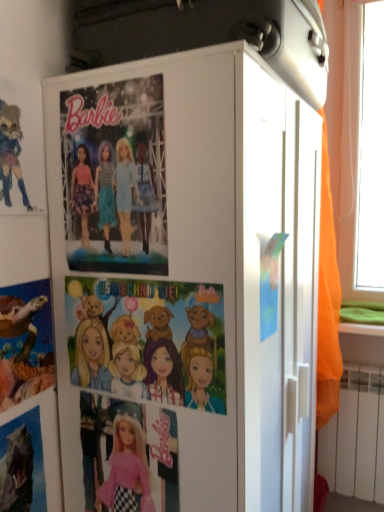
Question: Based on their sizes in the image, would you say shiny metallic dinosaur at lower left, which appears as the 2th comic book when viewed from the left, is bigger or smaller than matte plastic turtle at lower left, arranged as the first comic book when viewed from the left?

Choices:
 (A) big
 (B) small

Answer: (B)

Question: Is shiny metallic dinosaur at lower left, which is counted as the 2th comic book, starting from the right, situated inside matte plastic turtle at lower left, arranged as the first comic book when viewed from the left, or outside?

Choices:
 (A) inside
 (B) outside

Answer: (B)

Question: Based on their relative distances, which object is nearer to the cartoon paper comic at center, placed as the third comic book when sorted from left to right?

Choices:
 (A) orange fabric curtain at right
 (B) watercolor paper doll at upper left
 (C) white matte cabinet at center
 (D) matte plastic turtle at lower left, which ranks as the 3th comic book in right-to-left order
 (E) matte paper poster at center

Answer: (C)

Question: Which of these objects is positioned closest to the shiny metallic dinosaur at lower left, which is counted as the 2th comic book, starting from the right?

Choices:
 (A) watercolor paper doll at upper left
 (B) matte plastic turtle at lower left, arranged as the first comic book when viewed from the left
 (C) cartoon paper comic at center, placed as the third comic book when sorted from left to right
 (D) orange fabric curtain at right
 (E) matte paper poster at center

Answer: (B)